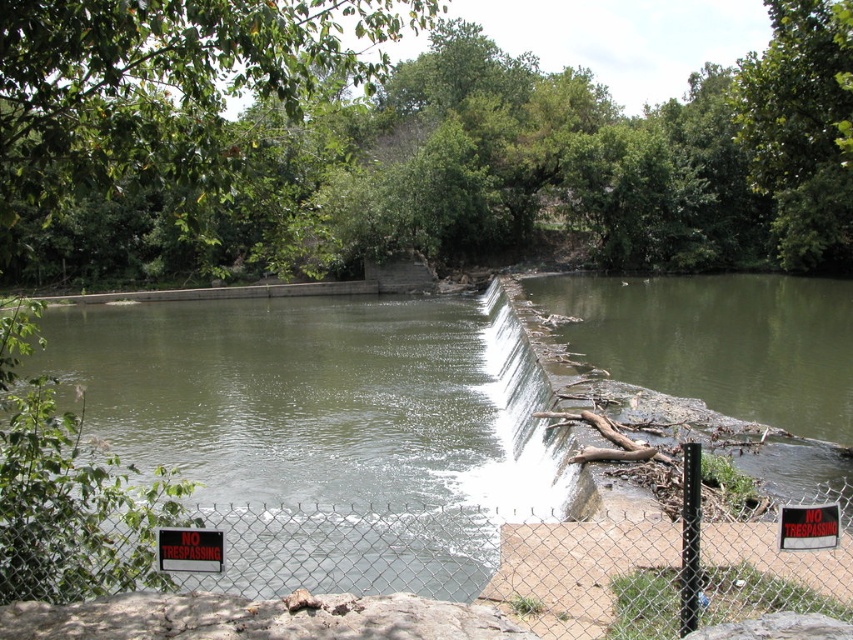
You are a park ranger assessing safety hazards. You notice the white concrete waterfall at center and the black plastic sign at center. Which object is wider from your vantage point?

The white concrete waterfall at center is wider than the black plastic sign at center.